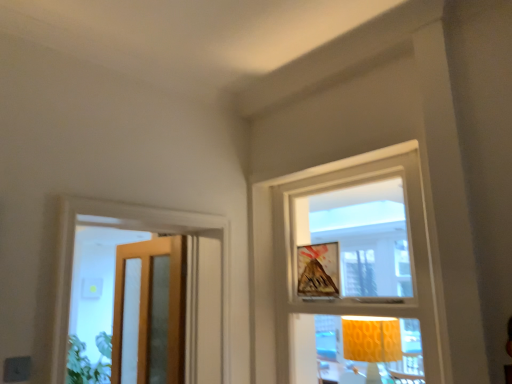
Question: Considering the positions of white textured frame at upper center, which is the 2th window from left to right, and clear glass door at left, arranged as the 2th window when viewed from the right, in the image, is white textured frame at upper center, which is the 2th window from left to right, wider or thinner than clear glass door at left, arranged as the 2th window when viewed from the right,?

Choices:
 (A) thin
 (B) wide

Answer: (B)

Question: Visually, is white textured frame at upper center, the first window positioned from the right, positioned to the left or to the right of clear glass door at left, arranged as the 2th window when viewed from the right?

Choices:
 (A) right
 (B) left

Answer: (A)

Question: Considering the real-world distances, which object is closest to the wooden glass door at left?

Choices:
 (A) matte yellow fabric lampshade at center
 (B) matte wooden picture frame at upper center
 (C) clear glass door at left, which ranks as the 1th window in left-to-right order
 (D) white textured frame at upper center, which is the 2th window from left to right

Answer: (C)

Question: Which of these objects is positioned closest to the clear glass door at left, arranged as the 2th window when viewed from the right?

Choices:
 (A) white textured frame at upper center, which is the 2th window from left to right
 (B) matte wooden picture frame at upper center
 (C) matte yellow fabric lampshade at center
 (D) wooden glass door at left

Answer: (D)